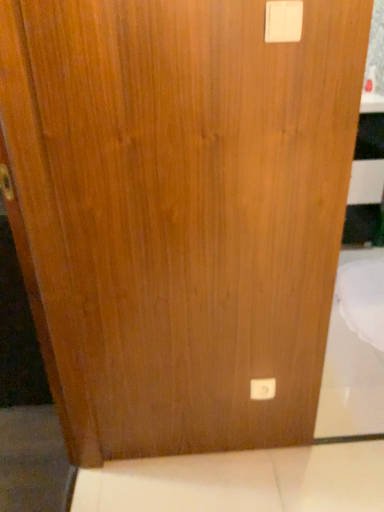
Question: Is white plastic light switch at upper right, which is counted as the 2th light switch, starting from the bottom, taller or shorter than white plastic light switch at lower center, arranged as the first light switch when viewed from the back?

Choices:
 (A) short
 (B) tall

Answer: (A)

Question: Considering the positions of point tap(299, 18) and point tap(258, 398), is point tap(299, 18) closer or farther from the camera than point tap(258, 398)?

Choices:
 (A) closer
 (B) farther

Answer: (A)

Question: From a real-world perspective, is white plastic light switch at upper right, which is counted as the 2th light switch, starting from the bottom, physically located above or below white plastic light switch at lower center, marked as the 1th light switch in a bottom-to-top arrangement?

Choices:
 (A) below
 (B) above

Answer: (B)

Question: Is white plastic light switch at lower center, marked as the 1th light switch in a bottom-to-top arrangement, in front of or behind white plastic light switch at upper right, which is counted as the 2th light switch, starting from the bottom, in the image?

Choices:
 (A) front
 (B) behind

Answer: (B)

Question: Would you say white plastic light switch at lower center, the second light switch from the top, is to the left or to the right of white plastic light switch at upper right, which ranks as the 1th light switch in front-to-back order, in the picture?

Choices:
 (A) right
 (B) left

Answer: (A)

Question: Considering the positions of white plastic light switch at lower center, the second light switch from the top, and white plastic light switch at upper right, marked as the 2th light switch in a back-to-front arrangement, in the image, is white plastic light switch at lower center, the second light switch from the top, taller or shorter than white plastic light switch at upper right, marked as the 2th light switch in a back-to-front arrangement,?

Choices:
 (A) short
 (B) tall

Answer: (B)

Question: Considering the positions of point (256, 399) and point (296, 12), is point (256, 399) closer or farther from the camera than point (296, 12)?

Choices:
 (A) farther
 (B) closer

Answer: (A)